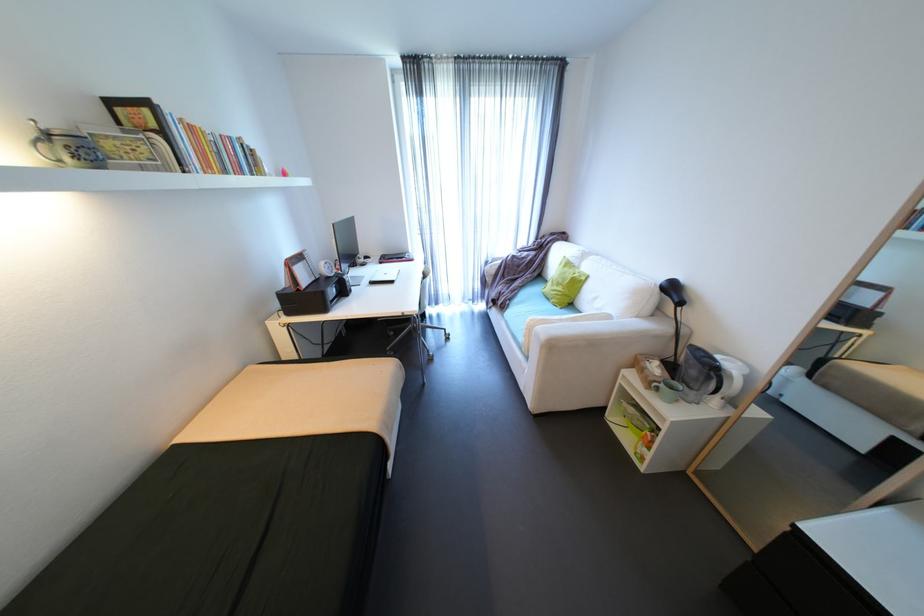
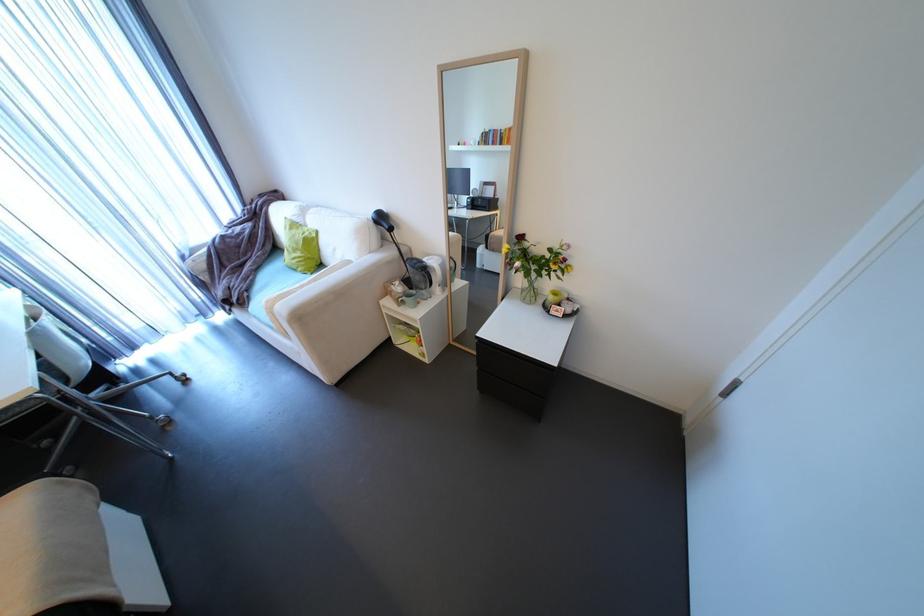
Find the pixel in the second image that matches (508,306) in the first image.

(248, 302)